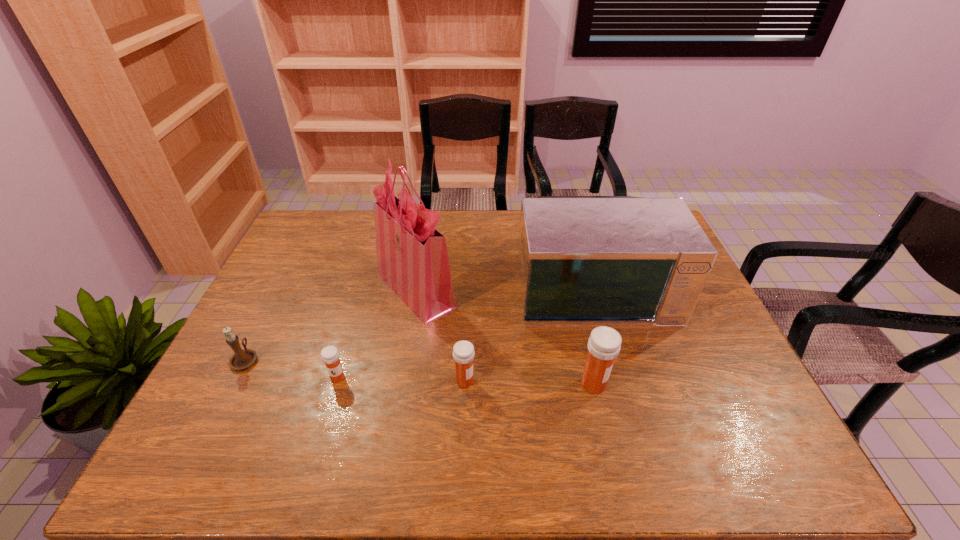
Where is `vacant area situated 0.050m on the label side of the shortest object`? The image size is (960, 540). vacant area situated 0.050m on the label side of the shortest object is located at coordinates (330, 402).

You are a GUI agent. You are given a task and a screenshot of the screen. Output one action in this format:
    pyautogui.click(x=<x>, y=<y>)
    Task: Click on the vacant space situated on the label side of the fourth object from left to right
    This screenshot has width=960, height=540.
    Given the screenshot: What is the action you would take?
    pyautogui.click(x=566, y=381)

The width and height of the screenshot is (960, 540). Find the location of `vacant region located on the label side of the rightmost medicine`. vacant region located on the label side of the rightmost medicine is located at coordinates (640, 384).

At what (x,y) coordinates should I click in order to perform the action: click on vacant space located on the left of the shopping bag. Please return your answer as a coordinate pair (x, y). The height and width of the screenshot is (540, 960). Looking at the image, I should click on (283, 290).

The image size is (960, 540). What are the coordinates of `vacant space located 0.150m on the side of the candle holder with the handle` in the screenshot? It's located at (272, 307).

In order to click on vacant space located 0.380m on the side of the candle holder with the handle in this screenshot , I will do `click(296, 259)`.

Find the location of `free space located 0.050m on the side of the candle holder with the handle`. free space located 0.050m on the side of the candle holder with the handle is located at coordinates (258, 332).

Find the location of a particular element. The height and width of the screenshot is (540, 960). vacant space located on the front-facing side of the microwave oven is located at coordinates (628, 406).

Locate an element on the screen. object that is at the near edge is located at coordinates (604, 344).

I want to click on object located in the left edge section of the desktop, so click(x=241, y=359).